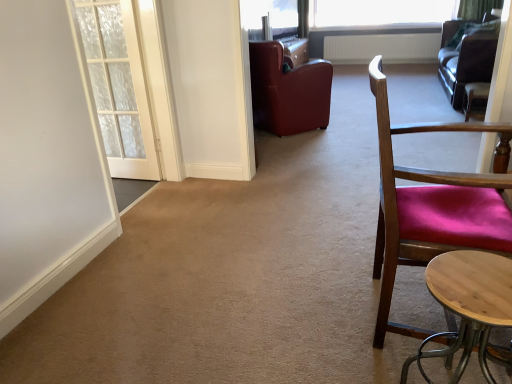
What are the coordinates of `free spot in front of leather at center, arranged as the second chair when viewed from the back` in the screenshot? It's located at (295, 150).